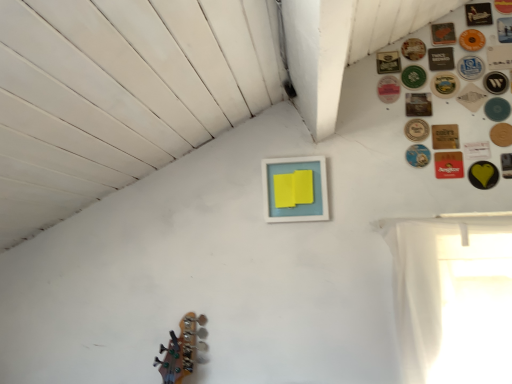
Question: In terms of height, does white sheer curtain at right look taller or shorter compared to matte blue picture frame at center?

Choices:
 (A) short
 (B) tall

Answer: (B)

Question: Is point (452, 344) positioned closer to the camera than point (303, 211)?

Choices:
 (A) farther
 (B) closer

Answer: (B)

Question: Which object is positioned closest to the brown leather coaster at upper right, positioned as the 19th button in top-to-bottom order?

Choices:
 (A) wooden coaster at upper right, acting as the twentieth button starting from the top
 (B) green matte button at upper right, the seventeenth button viewed from the top
 (C) wooden coaster at upper right, placed as the sixteenth button when sorted from top to bottom
 (D) green matte button at upper center, the 11th button when ordered from top to bottom
 (E) matte blue picture frame at center

Answer: (C)

Question: Estimate the real-world distances between objects in this image. Which object is farther from the green matte button at upper right, the ninth button positioned from the bottom?

Choices:
 (A) white matte button at upper right, which ranks as the 21th button in top-to-bottom order
 (B) brown leather coaster at upper right, placed as the 3th button when sorted from bottom to top
 (C) wooden coaster at upper right, which ranks as the 20th button in bottom-to-top order
 (D) yellow matte heart at upper right, placed as the second button when sorted from bottom to top
 (E) green matte button at upper right, placed as the ninth button when sorted from top to bottom

Answer: (E)